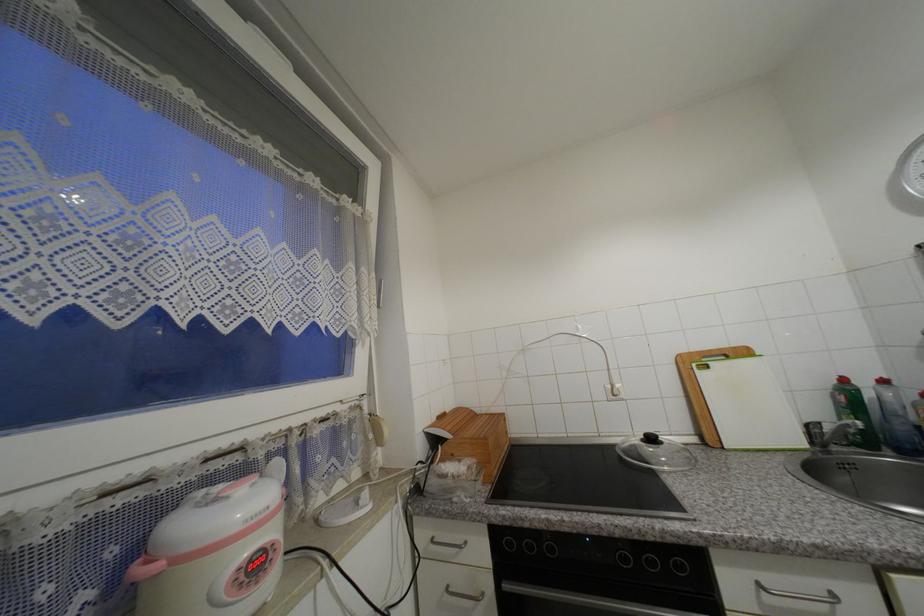
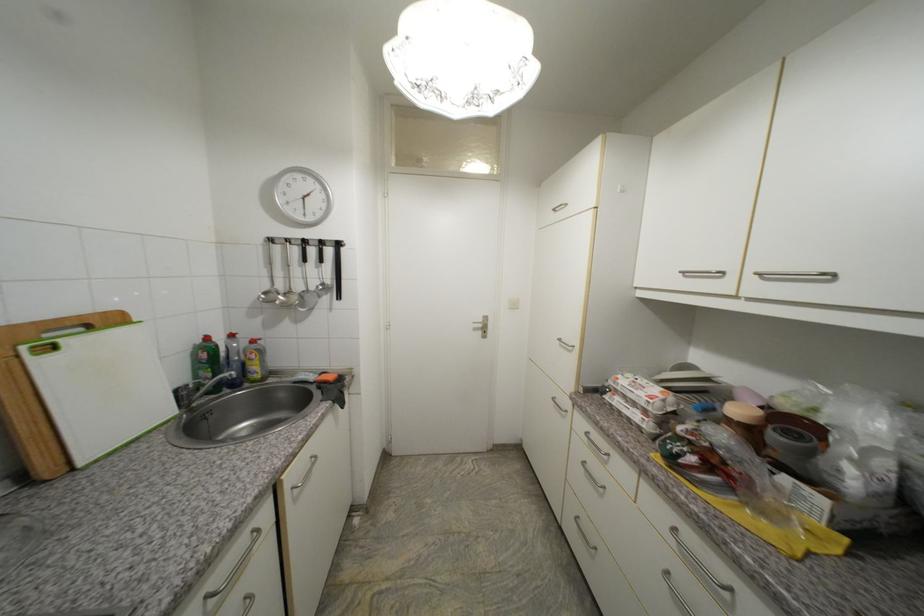
Find the pixel in the second image that matches pixel 699 367 in the first image.

(30, 349)